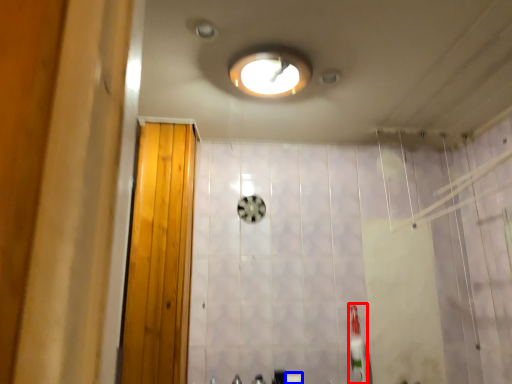
Question: Which object appears closest to the camera in this image, toothbrush (highlighted by a red box) or toilet paper (highlighted by a blue box)?

Choices:
 (A) toothbrush
 (B) toilet paper

Answer: (A)